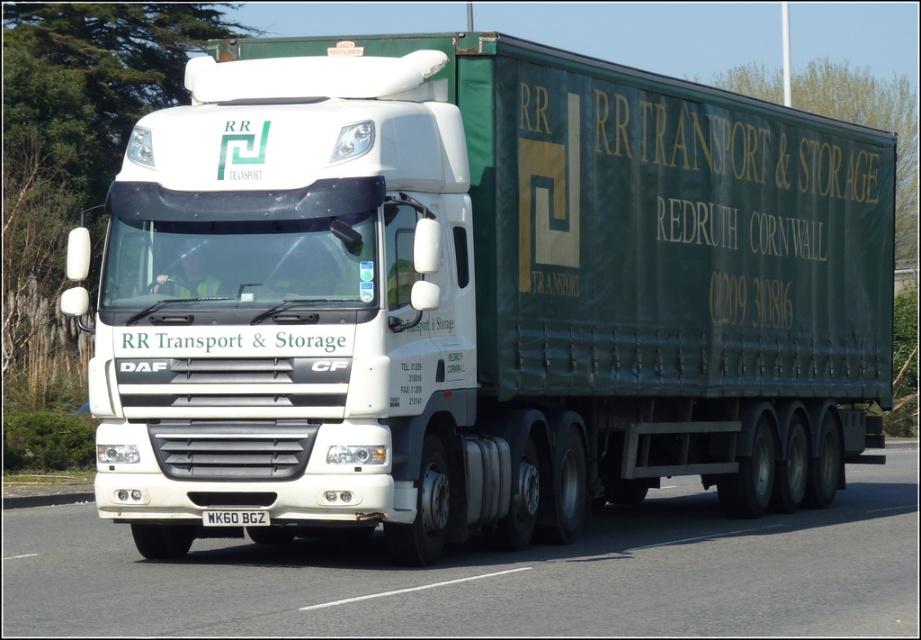
Question: Which object appears farthest from the camera in this image?

Choices:
 (A) black metal/license plate at center
 (B) white glossy truck at center

Answer: (A)

Question: Does white glossy truck at center appear on the left side of black metal/license plate at center?

Choices:
 (A) no
 (B) yes

Answer: (A)

Question: Which object appears farthest from the camera in this image?

Choices:
 (A) black metal/license plate at center
 (B) white glossy truck at center

Answer: (A)

Question: Can you confirm if white glossy truck at center is bigger than black metal/license plate at center?

Choices:
 (A) no
 (B) yes

Answer: (B)

Question: Is white glossy truck at center wider than black metal/license plate at center?

Choices:
 (A) no
 (B) yes

Answer: (B)

Question: Which point is farther from the camera taking this photo?

Choices:
 (A) (473, 621)
 (B) (210, 516)

Answer: (B)